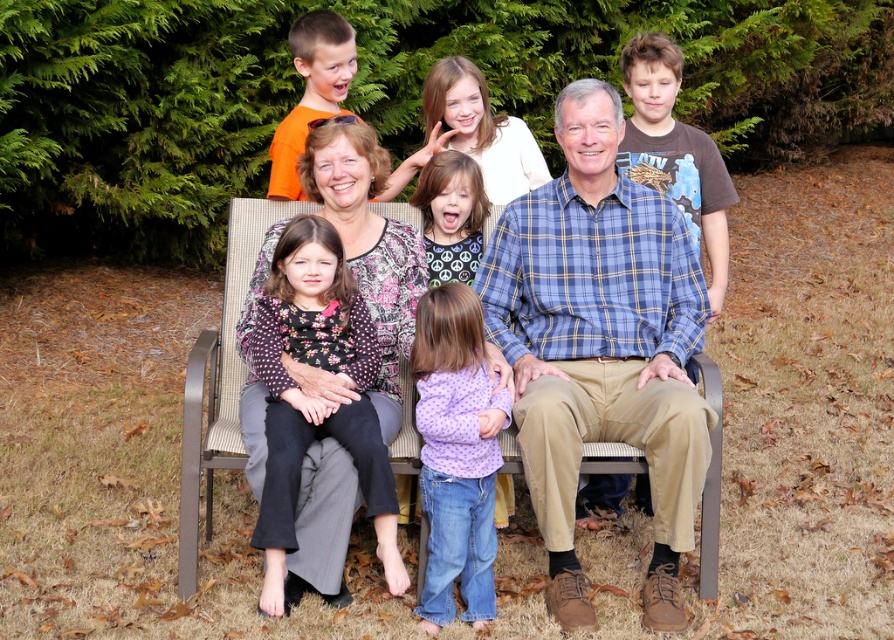
Question: Considering the relative positions of matte plaid shirt at center and green fabric shirt at center in the image provided, where is matte plaid shirt at center located with respect to green fabric shirt at center?

Choices:
 (A) below
 (B) above

Answer: (A)

Question: Can you confirm if blue plaid shirt at center is positioned above purple polka dot shirt at center?

Choices:
 (A) no
 (B) yes

Answer: (B)

Question: Can you confirm if floral-patterned shirt at left is bigger than brown cotton t-shirt at right?

Choices:
 (A) yes
 (B) no

Answer: (A)

Question: Among these points, which one is nearest to the camera?

Choices:
 (A) (254, 532)
 (B) (468, 397)
 (C) (443, 276)
 (D) (638, 264)

Answer: (A)

Question: Among these objects, which one is nearest to the camera?

Choices:
 (A) blue plaid shirt at center
 (B) green fabric shirt at center
 (C) matte plaid shirt at center
 (D) purple polka dot shirt at center

Answer: (A)

Question: Which point is farther from the camera taking this photo?

Choices:
 (A) (662, 400)
 (B) (492, 429)
 (C) (631, 394)
 (D) (487, 200)

Answer: (D)